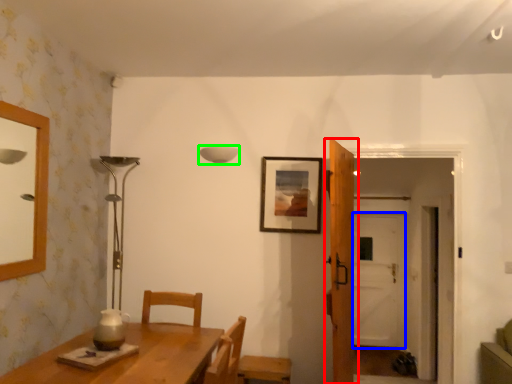
Question: Which object is positioned closest to door (highlighted by a red box)? Select from glass door (highlighted by a blue box) and lamp (highlighted by a green box).

Choices:
 (A) glass door
 (B) lamp

Answer: (B)